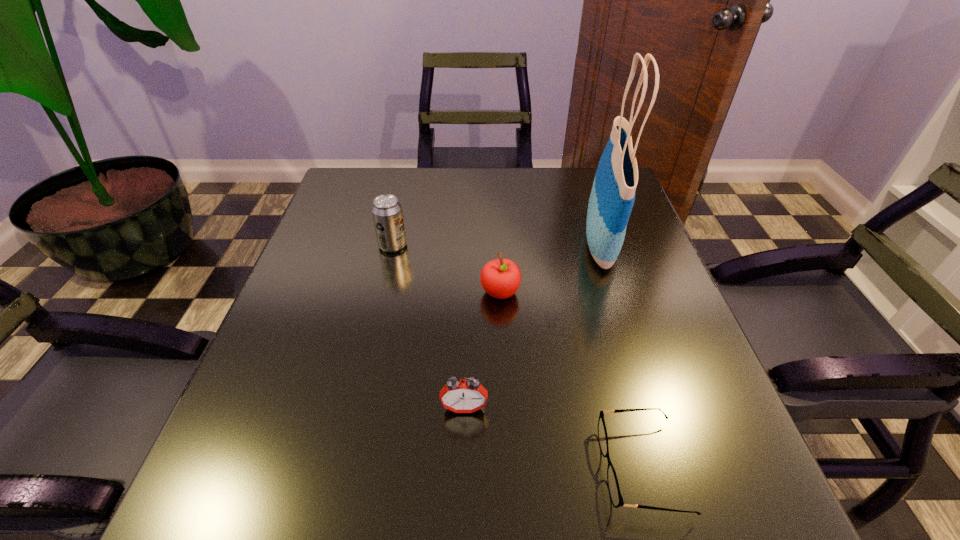
At what (x,y) coordinates should I click in order to perform the action: click on the tallest object. Please return your answer as a coordinate pair (x, y). Looking at the image, I should click on (612, 197).

The image size is (960, 540). In order to click on beer can in this screenshot , I will do `click(387, 213)`.

The image size is (960, 540). I want to click on the leftmost object, so click(387, 213).

Locate an element on the screen. The image size is (960, 540). apple is located at coordinates (500, 278).

The width and height of the screenshot is (960, 540). Find the location of `the fourth farthest object`. the fourth farthest object is located at coordinates (460, 396).

I want to click on spectacles, so click(x=614, y=490).

Where is `the nearest object`? The width and height of the screenshot is (960, 540). the nearest object is located at coordinates [x=614, y=490].

Locate an element on the screen. The width and height of the screenshot is (960, 540). free space located 0.370m on the left of the tote bag is located at coordinates (429, 242).

Where is `free space located on the front of the leftmost object`? Image resolution: width=960 pixels, height=540 pixels. free space located on the front of the leftmost object is located at coordinates (356, 403).

Image resolution: width=960 pixels, height=540 pixels. I want to click on blank area located 0.380m on the left of the apple, so click(306, 292).